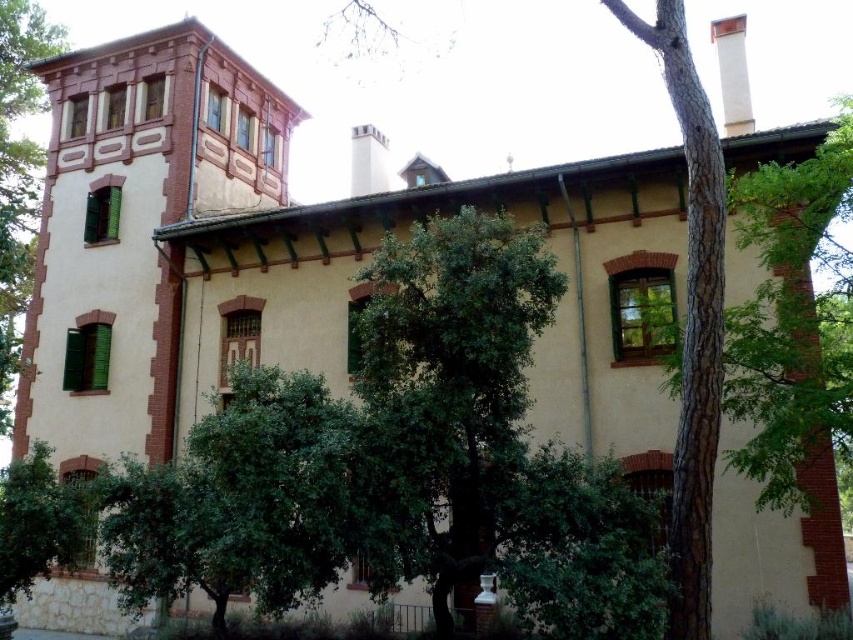
Question: Can you confirm if green leafy tree at center is smaller than green textured bark at center?

Choices:
 (A) yes
 (B) no

Answer: (B)

Question: Can you confirm if green textured bark at center is bigger than green leafy tree at left?

Choices:
 (A) no
 (B) yes

Answer: (A)

Question: Does green leafy tree at center appear on the right side of green leafy tree at left?

Choices:
 (A) no
 (B) yes

Answer: (B)

Question: Which point is closer to the camera?

Choices:
 (A) (24, 257)
 (B) (688, 307)

Answer: (B)

Question: Among these objects, which one is nearest to the camera?

Choices:
 (A) green leafy tree at center
 (B) green leafy tree at left
 (C) green textured bark at center

Answer: (A)

Question: Which object appears farthest from the camera in this image?

Choices:
 (A) green textured bark at center
 (B) green leafy tree at left

Answer: (B)